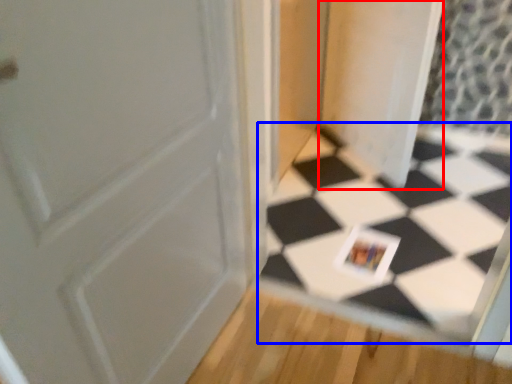
Question: Which object appears closest to the camera in this image, screen door (highlighted by a red box) or square (highlighted by a blue box)?

Choices:
 (A) screen door
 (B) square

Answer: (B)